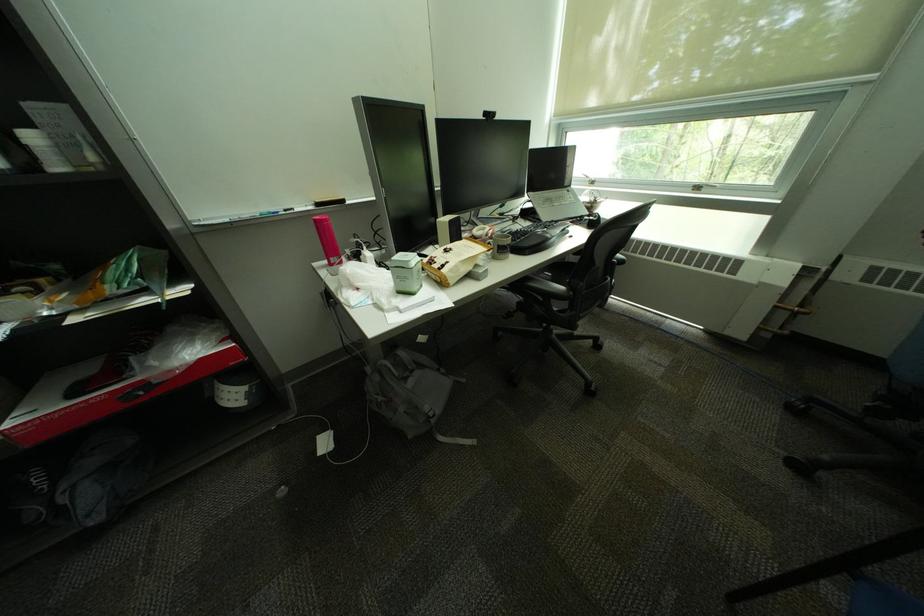
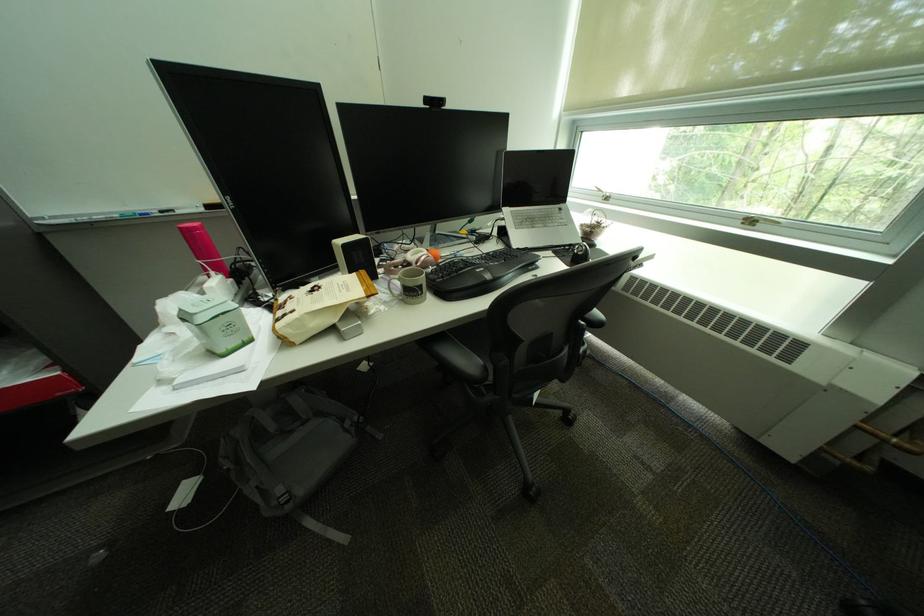
Which direction would the cameraman need to move to produce the second image?

The cameraman moved toward right, forward.